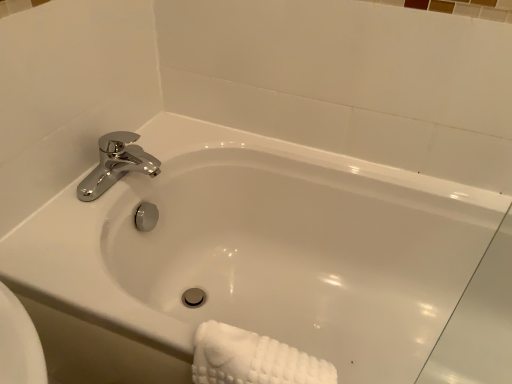
Question: Can you confirm if white glossy bathtub at center is bigger than chrome metallic faucet at upper left?

Choices:
 (A) yes
 (B) no

Answer: (A)

Question: Considering the relative sizes of white glossy bathtub at center and chrome metallic faucet at upper left in the image provided, is white glossy bathtub at center smaller than chrome metallic faucet at upper left?

Choices:
 (A) yes
 (B) no

Answer: (B)

Question: Can you confirm if white glossy bathtub at center is taller than chrome metallic faucet at upper left?

Choices:
 (A) yes
 (B) no

Answer: (A)

Question: From the image's perspective, does white glossy bathtub at center appear higher than chrome metallic faucet at upper left?

Choices:
 (A) yes
 (B) no

Answer: (B)

Question: Is white glossy bathtub at center touching chrome metallic faucet at upper left?

Choices:
 (A) no
 (B) yes

Answer: (A)

Question: Does point (257, 377) appear closer or farther from the camera than point (321, 223)?

Choices:
 (A) closer
 (B) farther

Answer: (A)

Question: In the image, is white textured towel at lower right positioned in front of or behind white glossy bathtub at center?

Choices:
 (A) front
 (B) behind

Answer: (B)

Question: Considering the positions of white textured towel at lower right and white glossy bathtub at center in the image, is white textured towel at lower right taller or shorter than white glossy bathtub at center?

Choices:
 (A) short
 (B) tall

Answer: (A)

Question: From the image's perspective, relative to white glossy bathtub at center, is white textured towel at lower right above or below?

Choices:
 (A) above
 (B) below

Answer: (B)

Question: In terms of size, does chrome metallic faucet at upper left appear bigger or smaller than white textured towel at lower right?

Choices:
 (A) big
 (B) small

Answer: (B)

Question: Considering the positions of point (137, 145) and point (220, 372), is point (137, 145) closer or farther from the camera than point (220, 372)?

Choices:
 (A) farther
 (B) closer

Answer: (A)

Question: Do you think chrome metallic faucet at upper left is within white textured towel at lower right, or outside of it?

Choices:
 (A) inside
 (B) outside

Answer: (B)

Question: Is chrome metallic faucet at upper left taller or shorter than white textured towel at lower right?

Choices:
 (A) short
 (B) tall

Answer: (A)

Question: From their relative heights in the image, would you say white textured towel at lower right is taller or shorter than chrome metallic faucet at upper left?

Choices:
 (A) tall
 (B) short

Answer: (A)

Question: Is white textured towel at lower right in front of or behind chrome metallic faucet at upper left in the image?

Choices:
 (A) behind
 (B) front

Answer: (B)